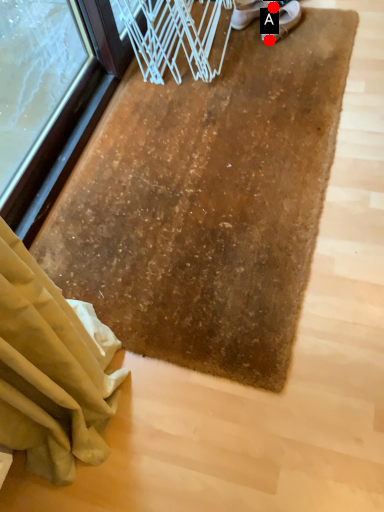
Question: Two points are circled on the image, labeled by A and B beside each circle. Which of the following is the closest to the observer?

Choices:
 (A) A is closer
 (B) B is closer

Answer: (A)